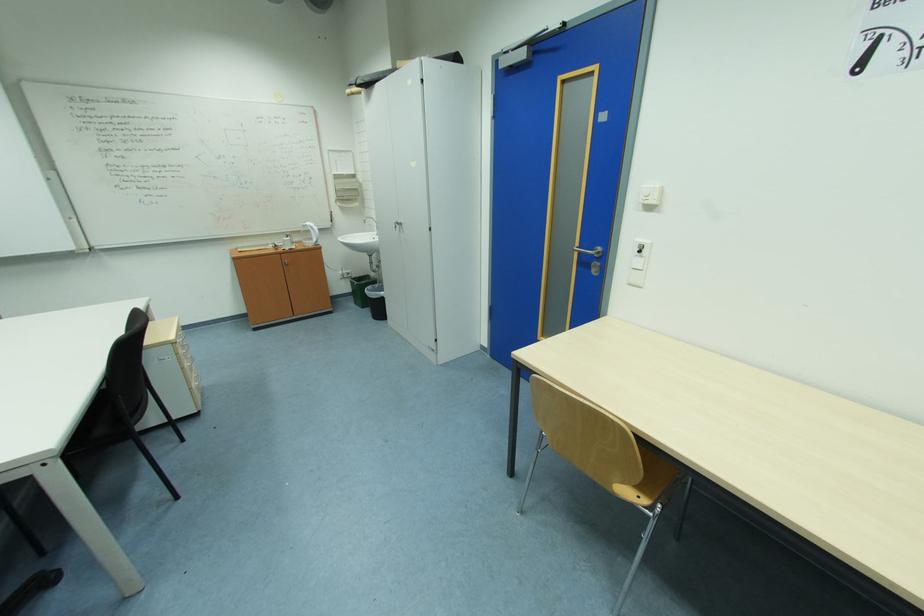
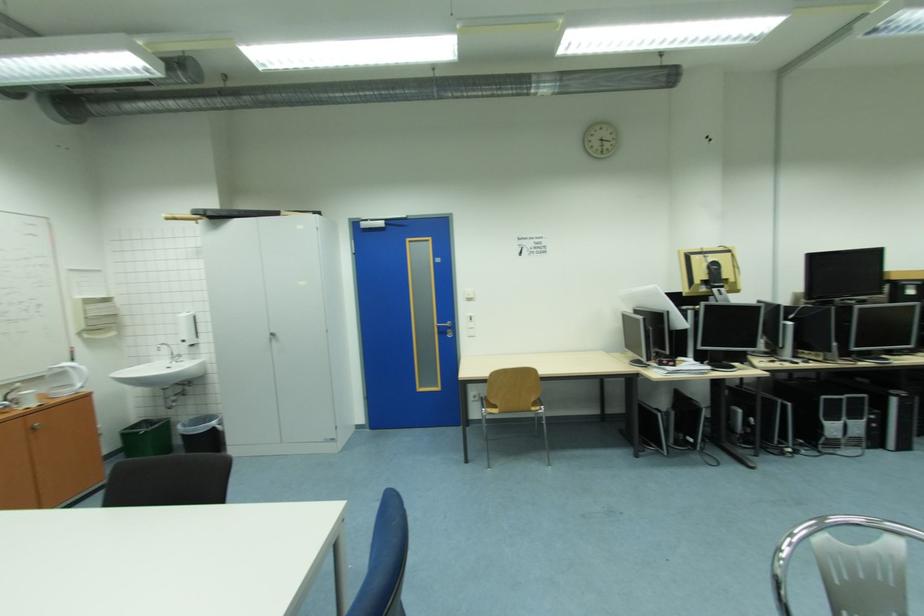
In the second image, find the point that corresponds to pixel 657 209 in the first image.

(477, 301)